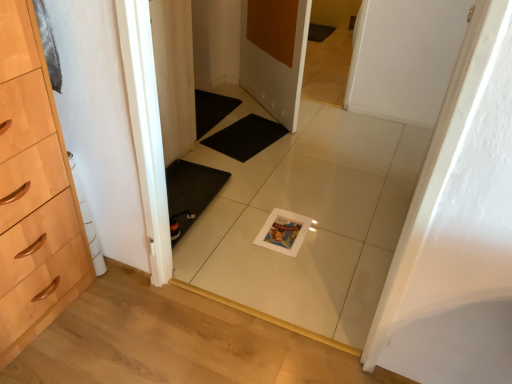
Question: From the image's perspective, is black rubber bath mat at center under white glossy tile at center?

Choices:
 (A) yes
 (B) no

Answer: (B)

Question: From the image's perspective, is black rubber bath mat at center located above white glossy tile at center?

Choices:
 (A) no
 (B) yes

Answer: (B)

Question: Does black rubber bath mat at center appear on the right side of white glossy tile at center?

Choices:
 (A) yes
 (B) no

Answer: (B)

Question: Is black rubber bath mat at center aimed at white glossy tile at center?

Choices:
 (A) yes
 (B) no

Answer: (B)

Question: Can white glossy tile at center be found inside black rubber bath mat at center?

Choices:
 (A) yes
 (B) no

Answer: (B)

Question: From a real-world perspective, relative to white glossy tile at center, is white matte door at center, the 2th door when ordered from back to front, vertically above or below?

Choices:
 (A) below
 (B) above

Answer: (A)

Question: Based on their sizes in the image, would you say white matte door at center, arranged as the 1th door when viewed from the front, is bigger or smaller than white glossy tile at center?

Choices:
 (A) big
 (B) small

Answer: (A)

Question: Considering the positions of white matte door at center, arranged as the 1th door when viewed from the front, and white glossy tile at center in the image, is white matte door at center, arranged as the 1th door when viewed from the front, wider or thinner than white glossy tile at center?

Choices:
 (A) wide
 (B) thin

Answer: (B)

Question: In the image, is white matte door at center, which is counted as the first door, starting from the right, positioned in front of or behind white glossy tile at center?

Choices:
 (A) behind
 (B) front

Answer: (B)

Question: Is point (233, 125) closer or farther from the camera than point (275, 8)?

Choices:
 (A) closer
 (B) farther

Answer: (B)

Question: From the image's perspective, is black rubber bath mat at center positioned above or below matte white door at center, which is counted as the first door, starting from the back?

Choices:
 (A) above
 (B) below

Answer: (B)

Question: Looking at their shapes, would you say black rubber bath mat at center is wider or thinner than matte white door at center, the 2th door from the right?

Choices:
 (A) thin
 (B) wide

Answer: (B)

Question: Relative to matte white door at center, which is the second door in front-to-back order, is black rubber bath mat at center in front or behind?

Choices:
 (A) behind
 (B) front

Answer: (A)

Question: Is white glossy tile at center in front of or behind matte white door at center, the 2th door from the right, in the image?

Choices:
 (A) front
 (B) behind

Answer: (A)

Question: Considering the positions of white glossy tile at center and matte white door at center, which is counted as the first door, starting from the left, in the image, is white glossy tile at center bigger or smaller than matte white door at center, which is counted as the first door, starting from the left,?

Choices:
 (A) big
 (B) small

Answer: (A)